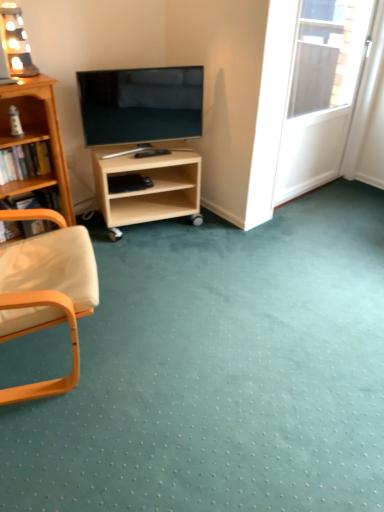
Question: Considering the relative sizes of white glossy screen door at upper right and wooden bookcase at left in the image provided, is white glossy screen door at upper right thinner than wooden bookcase at left?

Choices:
 (A) yes
 (B) no

Answer: (A)

Question: Is white glossy screen door at upper right positioned beyond the bounds of wooden bookcase at left?

Choices:
 (A) no
 (B) yes

Answer: (B)

Question: Can you confirm if white glossy screen door at upper right is smaller than wooden bookcase at left?

Choices:
 (A) yes
 (B) no

Answer: (A)

Question: Can you confirm if white glossy screen door at upper right is wider than wooden bookcase at left?

Choices:
 (A) no
 (B) yes

Answer: (A)

Question: Does white glossy screen door at upper right contain wooden bookcase at left?

Choices:
 (A) yes
 (B) no

Answer: (B)

Question: Does white glossy screen door at upper right have a greater height compared to wooden bookcase at left?

Choices:
 (A) no
 (B) yes

Answer: (B)

Question: Can you confirm if wooden chair arm at left, which is the 1th book from bottom to top, is bigger than wooden bookshelf at left, the 2th book when ordered from bottom to top?

Choices:
 (A) no
 (B) yes

Answer: (B)

Question: Can you confirm if wooden chair arm at left, which is the 1th book from bottom to top, is wider than wooden bookshelf at left, which is counted as the first book, starting from the top?

Choices:
 (A) yes
 (B) no

Answer: (A)

Question: Is wooden chair arm at left, which is counted as the second book, starting from the top, placed right next to wooden bookshelf at left, the 2th book when ordered from bottom to top?

Choices:
 (A) no
 (B) yes

Answer: (A)

Question: Does wooden chair arm at left, which is the 1th book from bottom to top, appear on the right side of wooden bookshelf at left, the 2th book when ordered from bottom to top?

Choices:
 (A) yes
 (B) no

Answer: (B)

Question: Is the position of wooden chair arm at left, which is counted as the second book, starting from the top, more distant than that of wooden bookshelf at left, the 2th book when ordered from bottom to top?

Choices:
 (A) yes
 (B) no

Answer: (A)

Question: From the image's perspective, is wooden chair arm at left, which is counted as the second book, starting from the top, below wooden bookshelf at left, the 2th book when ordered from bottom to top?

Choices:
 (A) yes
 (B) no

Answer: (A)

Question: Could you tell me if light wood/unfinishedobject at center is facing wooden armchair at left?

Choices:
 (A) no
 (B) yes

Answer: (A)